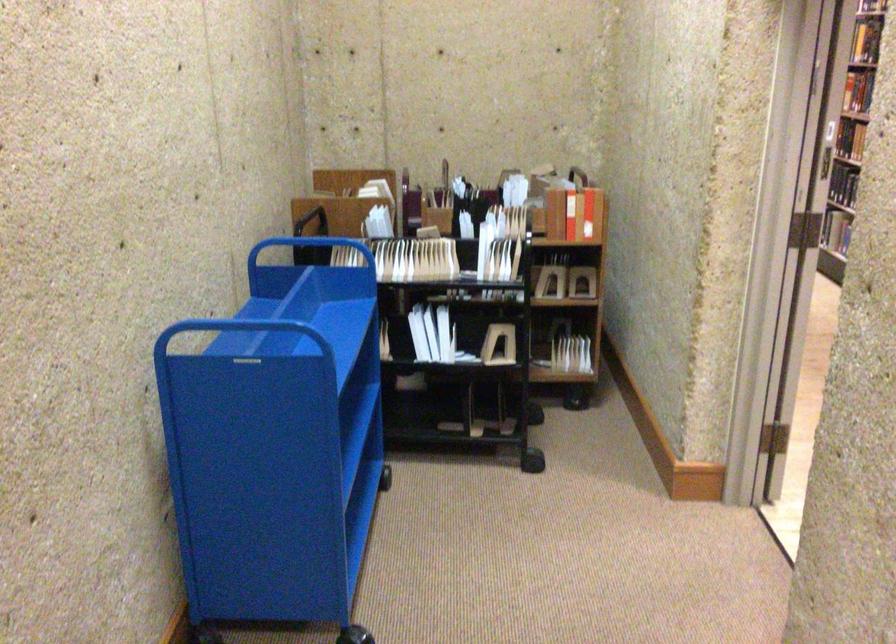
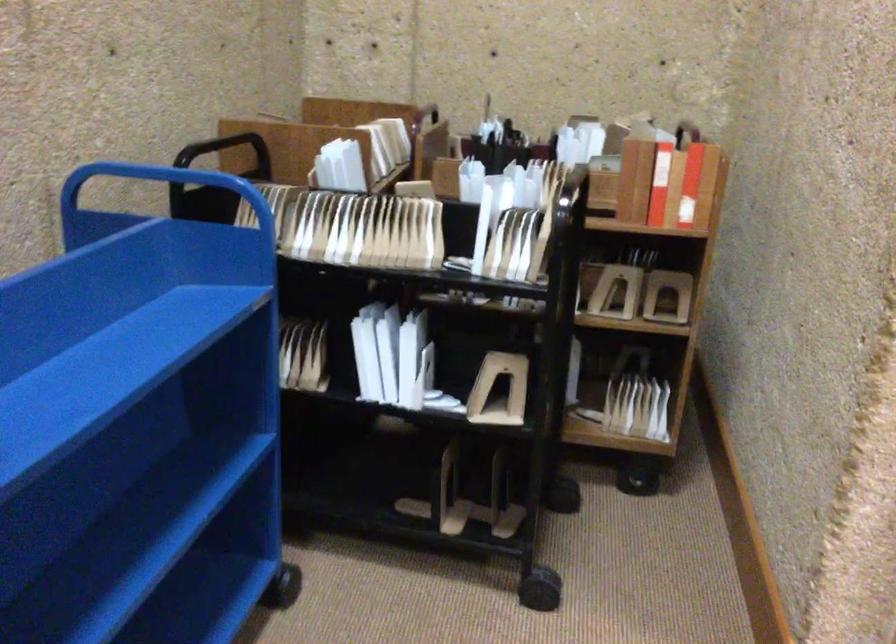
Question: In a continuous first-person perspective shot, in which direction is the camera moving?

Choices:
 (A) Left
 (B) Right
 (C) Forward
 (D) Backward

Answer: (C)